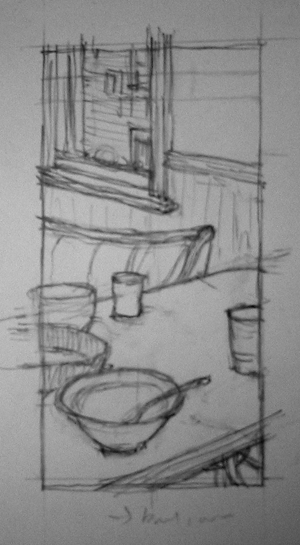
This screenshot has height=545, width=300. Find the location of `drywall`. drywall is located at coordinates point(218,89).